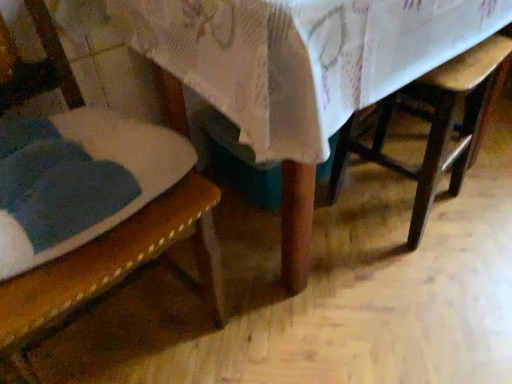
I want to click on free space to the right of wooden chair at lower right, so click(x=481, y=199).